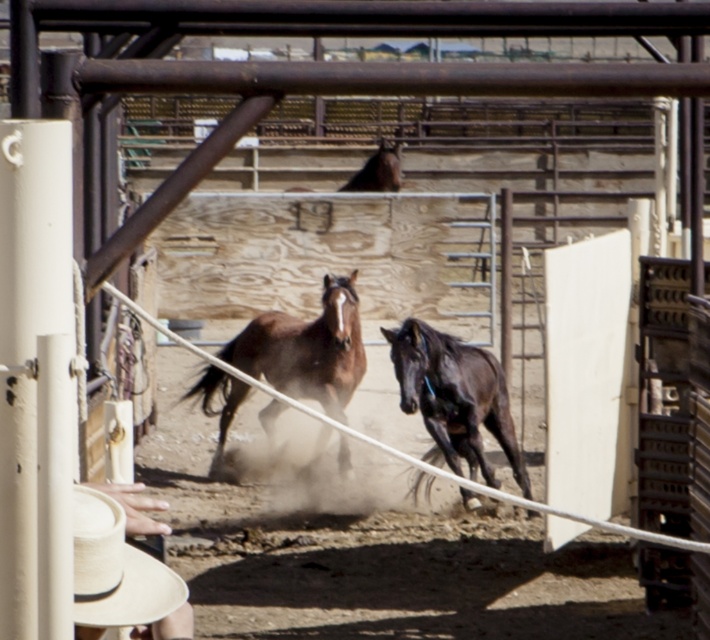
You are a rodeo participant standing at the entrance of the facility. You see the brown glossy horse at center and the natural straw cowboy hat at lower left. Which object is closer to your right side?

The natural straw cowboy hat at lower left is closer to your right side because the brown glossy horse at center is to the left of it, meaning the hat is positioned to the right relative to the horse.

You are a rodeo attendee trying to take a photo of both the brown glossy horse at center and the shiny black horse at center. Which horse should you focus on first to capture them both in the frame?

You should focus on the brown glossy horse at center first because the shiny black horse at center is behind it, ensuring both are visible in the frame.

You are a photographer standing at the camera position. You want to pick up the natural straw cowboy hat at lower left to use as a prop in your photo. Can you comfortably reach it without moving your feet?

The natural straw cowboy hat at lower left is 3.01 meters away from the camera. Since this distance is beyond typical comfortable reaching range, you cannot reach it without moving your feet.